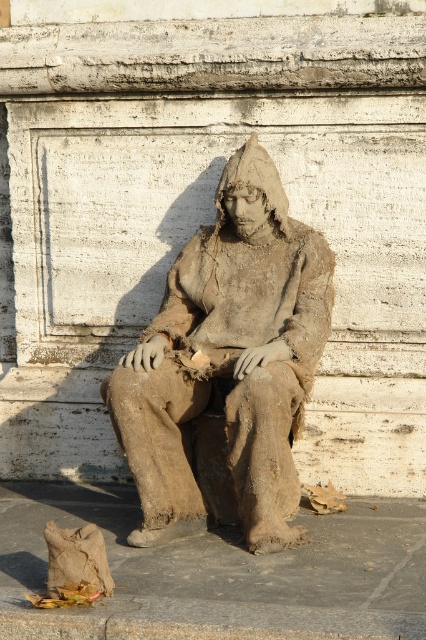
You are a delivery person who needs to place a package exactly 1 meter away from the brown textured statue at center. Can you place the package near the brown fabric bag at lower left?

The distance between the brown textured statue at center and the brown fabric bag at lower left is 70.49 centimeters, which is less than 1 meter. Therefore, placing the package near the brown fabric bag at lower left would not meet the requirement of being 1 meter away from the statue.

You are an art student who needs to determine the relative sizes of the objects in the scene for a project. Given that you see the brown textured statue at center and the brown fabric bag at lower left, which object is taller?

The brown textured statue at center is taller than the brown fabric bag at lower left according to the description.